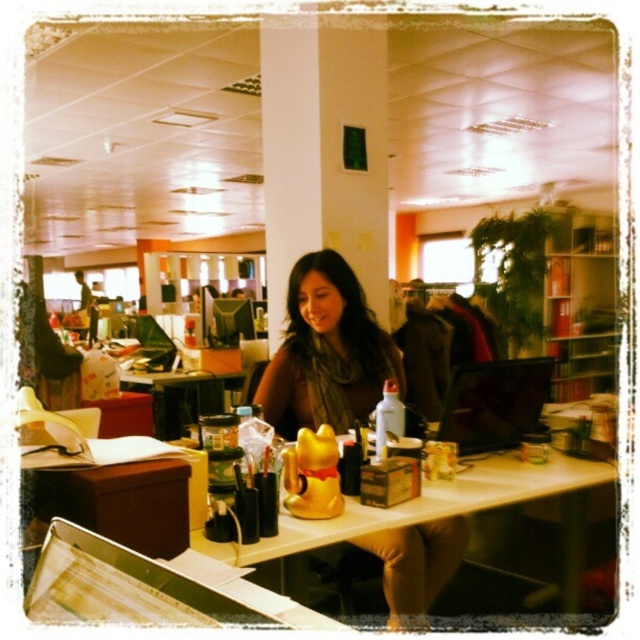
Question: Does matte gold statue at center have a larger size compared to white glossy table at center?

Choices:
 (A) no
 (B) yes

Answer: (A)

Question: Is matte gold statue at center behind white glossy table at center?

Choices:
 (A) no
 (B) yes

Answer: (B)

Question: Which of these objects is positioned closest to the brown hair at center?

Choices:
 (A) matte gold statue at center
 (B) white glossy table at center

Answer: (A)

Question: Which point appears closest to the camera in this image?

Choices:
 (A) (470, 467)
 (B) (291, 396)
 (C) (337, 365)

Answer: (A)

Question: Which point is closer to the camera taking this photo?

Choices:
 (A) (342, 420)
 (B) (300, 394)
 (C) (516, 481)

Answer: (C)

Question: Does matte gold statue at center have a greater width compared to brown hair at center?

Choices:
 (A) no
 (B) yes

Answer: (A)